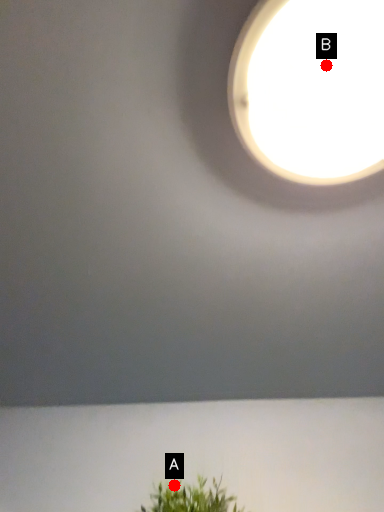
Question: Two points are circled on the image, labeled by A and B beside each circle. Which point is farther to the camera?

Choices:
 (A) A is further
 (B) B is further

Answer: (A)